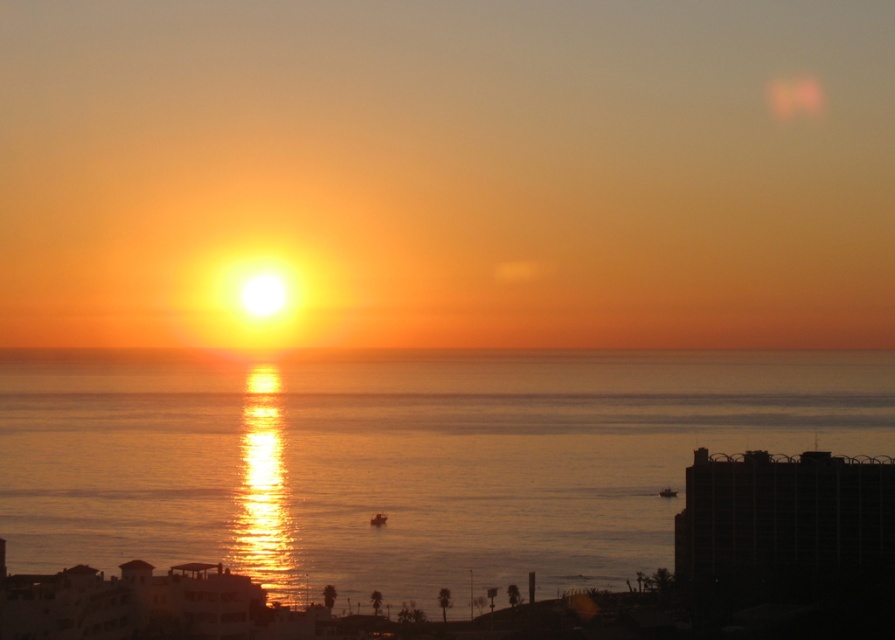
You are an architect designing a new coastal observatory. You want to ensure the main viewing window faces the glistening water at center and the orange matte horizon at center. Which object should be placed to the left of the other to align with their positions in the image?

The glistening water at center might be wider than orange matte horizon at center, so the orange matte horizon at center should be placed to the left of the glistening water at center to match their arrangement in the image.

You are an artist planning to paint the sunset scene. You want to ensure the glistening water at center and orange matte horizon at center are proportionally accurate. Which object should you paint larger?

The glistening water at center should be painted larger than the orange matte horizon at center because it is larger in size according to the description.

You are standing on a cliff overlooking the sunset scene. You notice the glistening water at center and the orange matte horizon at center. Which object is nearer to you?

The glistening water at center is closer to the viewer than the orange matte horizon at center.